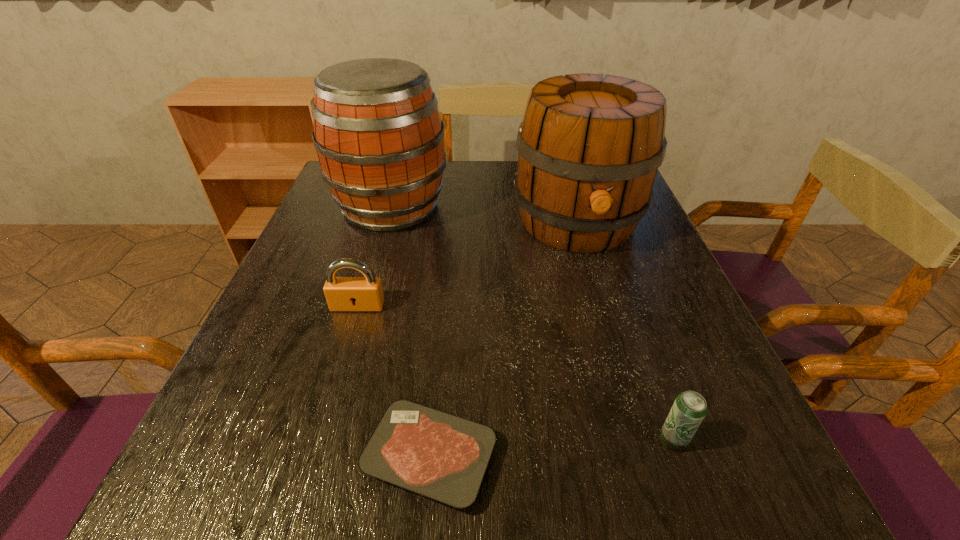
The image size is (960, 540). I want to click on free space that satisfies the following two spatial constraints: 1. on the side of the right cider where the spigot is located; 2. on the left side of the fourth tallest object, so click(640, 440).